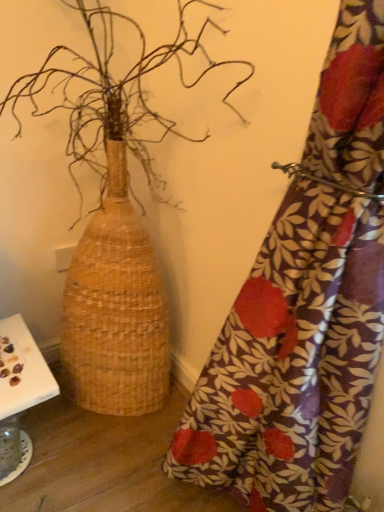
Question: Does floral fabric curtain at right have a lesser height compared to natural woven basket at left?

Choices:
 (A) yes
 (B) no

Answer: (A)

Question: Is floral fabric curtain at right further to camera compared to natural woven basket at left?

Choices:
 (A) no
 (B) yes

Answer: (A)

Question: Is floral fabric curtain at right positioned beyond the bounds of natural woven basket at left?

Choices:
 (A) no
 (B) yes

Answer: (B)

Question: Considering the relative sizes of floral fabric curtain at right and natural woven basket at left in the image provided, is floral fabric curtain at right smaller than natural woven basket at left?

Choices:
 (A) no
 (B) yes

Answer: (B)

Question: Is floral fabric curtain at right not close to natural woven basket at left?

Choices:
 (A) no
 (B) yes

Answer: (A)

Question: In the image, is white paper at lower left positioned in front of or behind floral fabric curtain at right?

Choices:
 (A) behind
 (B) front

Answer: (A)

Question: From the image's perspective, is white paper at lower left located above or below floral fabric curtain at right?

Choices:
 (A) above
 (B) below

Answer: (B)

Question: Is white paper at lower left inside the boundaries of floral fabric curtain at right, or outside?

Choices:
 (A) inside
 (B) outside

Answer: (B)

Question: Is point click(x=23, y=394) closer or farther from the camera than point click(x=258, y=303)?

Choices:
 (A) closer
 (B) farther

Answer: (B)

Question: Is natural woven basket at left in front of or behind floral fabric curtain at right in the image?

Choices:
 (A) behind
 (B) front

Answer: (A)

Question: Do you think natural woven basket at left is within floral fabric curtain at right, or outside of it?

Choices:
 (A) inside
 (B) outside

Answer: (B)

Question: From their relative heights in the image, would you say natural woven basket at left is taller or shorter than floral fabric curtain at right?

Choices:
 (A) tall
 (B) short

Answer: (A)

Question: In the image, is natural woven basket at left on the left side or the right side of floral fabric curtain at right?

Choices:
 (A) right
 (B) left

Answer: (B)

Question: From a real-world perspective, is floral fabric curtain at right positioned above or below natural woven basket at left?

Choices:
 (A) below
 (B) above

Answer: (B)

Question: Looking at their shapes, would you say floral fabric curtain at right is wider or thinner than natural woven basket at left?

Choices:
 (A) wide
 (B) thin

Answer: (B)